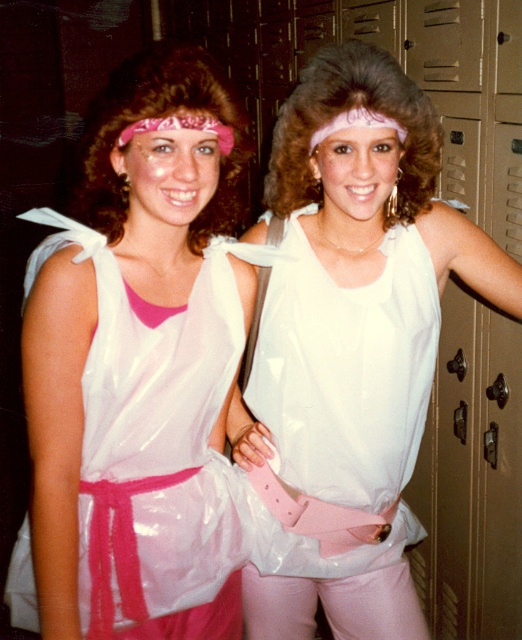
You are standing in front of the two Jazzercise participants. If you want to move from the point at coordinate (370, 188) to the point at coordinate (398, 227), which direction should you move?

You should move backward since point (370, 188) is in front of point (398, 227).

You are a dancer preparing for a performance and need to decide whether you can fit both the matte plastic toga at center and the white glossy dress at center into your 25 cm wide costume case. Can you fit them side by side?

The distance between the matte plastic toga at center and the white glossy dress at center is 20.20 centimeters, so yes, they can fit side by side in the 25 cm wide costume case since 20.20 cm is less than 25 cm.

You are trying to decide which clothing item to purchase between the matte white tank top at center and the white glossy dress at center. Based on their positions in the image, which one appears to be more prominent?

The matte white tank top at center is closer to the viewer than the white glossy dress at center, so it appears more prominent.